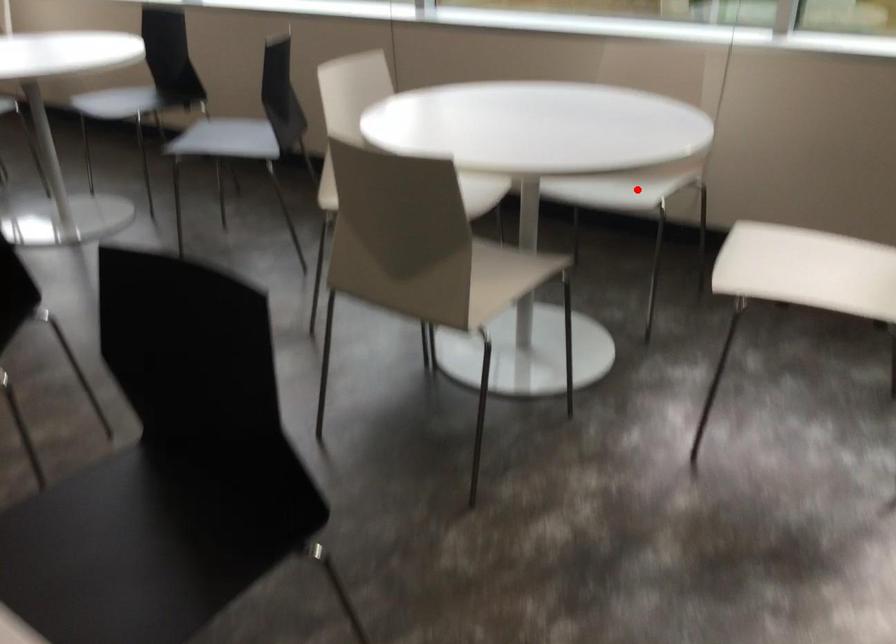
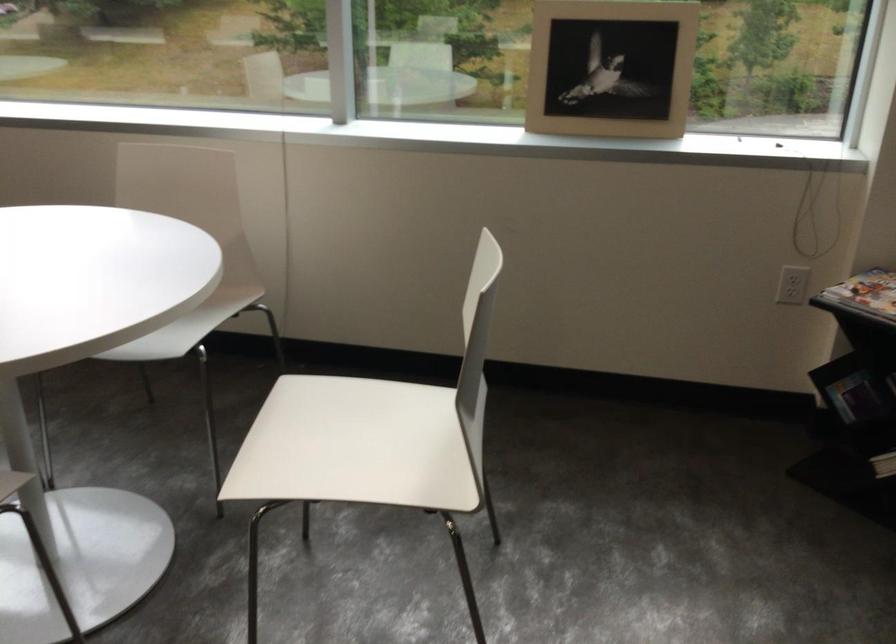
Where in the second image is the point corresponding to the highlighted location from the first image?

(186, 327)